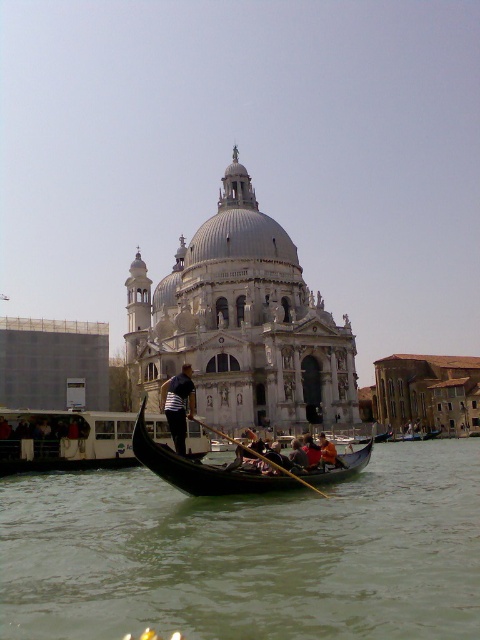
You are a tourist standing on the canal bridge and want to take a photo of the gondola. The gondola is at point (248,554). Where should you position yourself to capture the gondola in the center of your photo?

You should position yourself directly above the point (248,554) to center the gondola in your photo.

You are a tourist standing on the canal bridge and want to take a photo of the black polished wood gondola at center and the orange fabric person at center. Which object should you focus on first if you want to capture both in one shot without moving the camera?

The black polished wood gondola at center is taller than the orange fabric person at center, so you should focus on the black polished wood gondola at center first to ensure both are in frame.